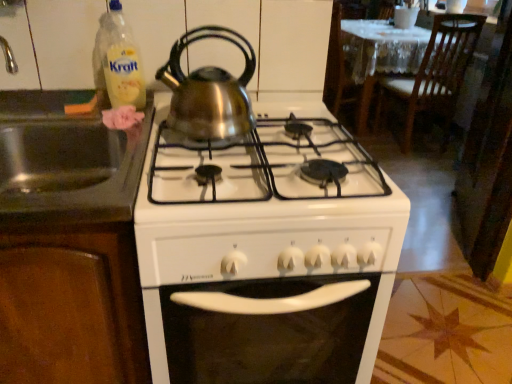
Question: Is satin silver kettle at upper center in front of or behind wooden chair at upper right in the image?

Choices:
 (A) front
 (B) behind

Answer: (A)

Question: In terms of width, does satin silver kettle at upper center look wider or thinner when compared to wooden chair at upper right?

Choices:
 (A) wide
 (B) thin

Answer: (B)

Question: Considering the real-world distances, which object is farthest from the stainless steel sink at left?

Choices:
 (A) satin silver kettle at upper center
 (B) stained wood cabinet at left
 (C) translucent plastic bottle at upper left
 (D) wooden chair at upper right
 (E) white glossy gas stove at center

Answer: (D)

Question: Which of these objects is positioned farthest from the satin silver kettle at upper center?

Choices:
 (A) translucent plastic bottle at upper left
 (B) stained wood cabinet at left
 (C) stainless steel sink at left
 (D) white glossy gas stove at center
 (E) wooden chair at upper right

Answer: (E)